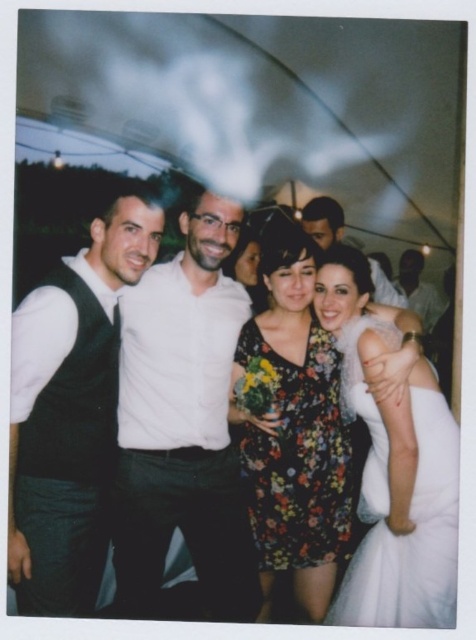
Question: Is matte black vest at left above matte white shirt at center?

Choices:
 (A) no
 (B) yes

Answer: (A)

Question: Where is white matte shirt at center located in relation to floral dress at center in the image?

Choices:
 (A) right
 (B) left

Answer: (A)

Question: Which point appears farthest from the camera in this image?

Choices:
 (A) (78, 304)
 (B) (201, 403)
 (C) (241, 513)
 (D) (398, 273)

Answer: (D)

Question: Among these points, which one is nearest to the camera?

Choices:
 (A) (57, 310)
 (B) (377, 276)
 (C) (304, 467)

Answer: (A)

Question: Is white matte shirt at center smaller than dark brown leather jacket at upper right?

Choices:
 (A) yes
 (B) no

Answer: (B)

Question: Considering the real-world distances, which object is closest to the dark brown leather jacket at upper right?

Choices:
 (A) white matte shirt at center
 (B) floral print fabric dress at center
 (C) matte white shirt at center

Answer: (C)